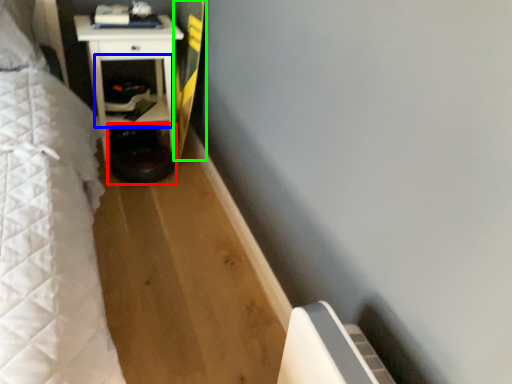
Question: Estimate the real-world distances between objects in this image. Which object is closer to step stool (highlighted by a red box), shelf (highlighted by a blue box) or longboard (highlighted by a green box)?

Choices:
 (A) shelf
 (B) longboard

Answer: (A)